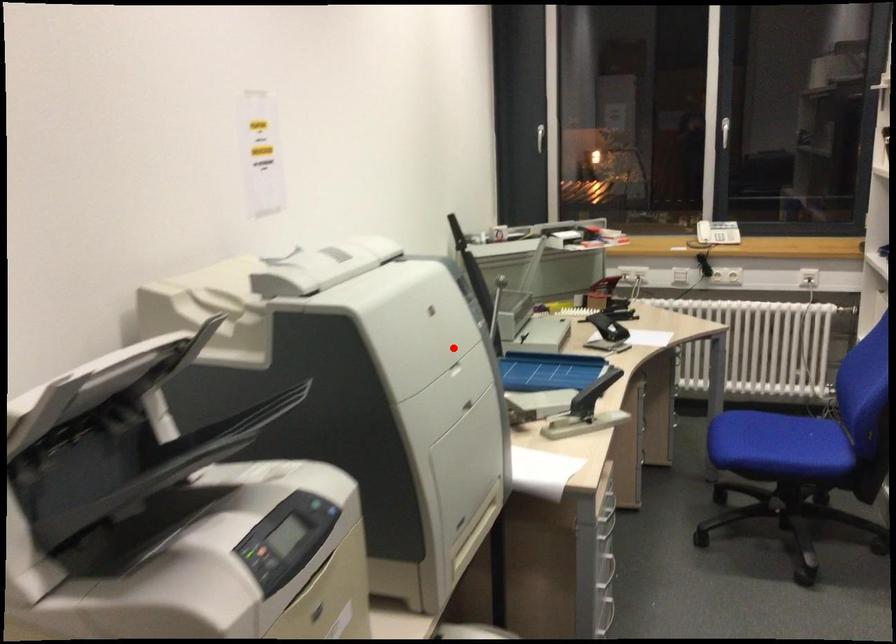
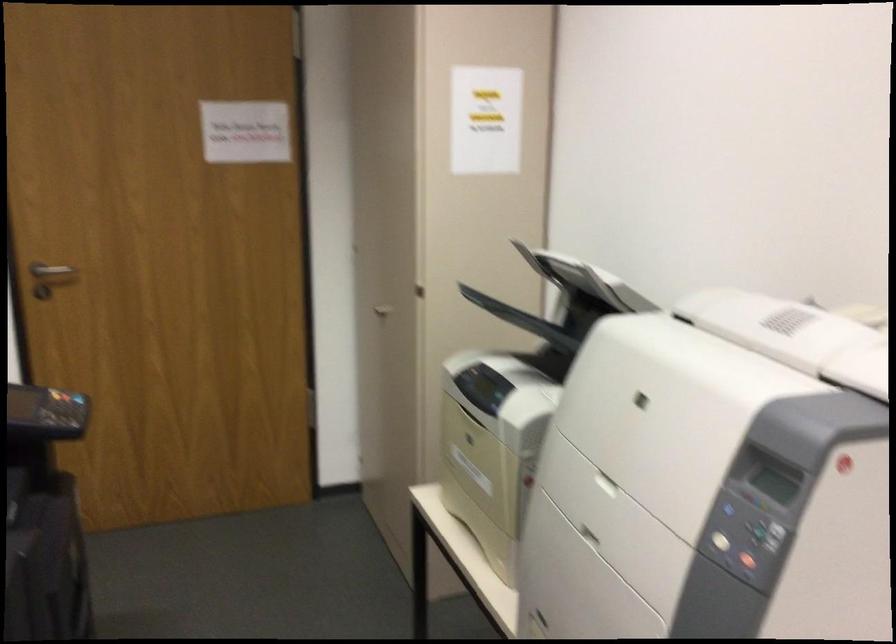
Find the pixel in the second image that matches the highlighted location in the first image.

(717, 542)